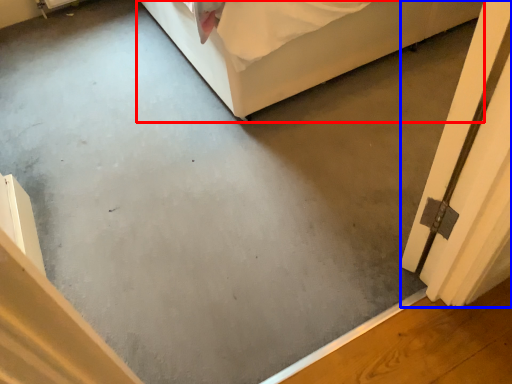
Question: Which object appears closest to the camera in this image, furniture (highlighted by a red box) or screen door (highlighted by a blue box)?

Choices:
 (A) furniture
 (B) screen door

Answer: (B)